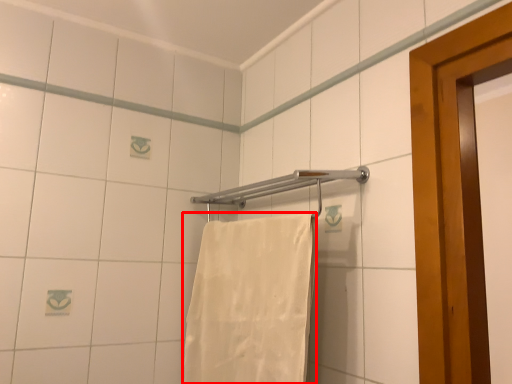
Question: From the image's perspective, where is towel (annotated by the red box) located relative to towel bar?

Choices:
 (A) below
 (B) above

Answer: (A)